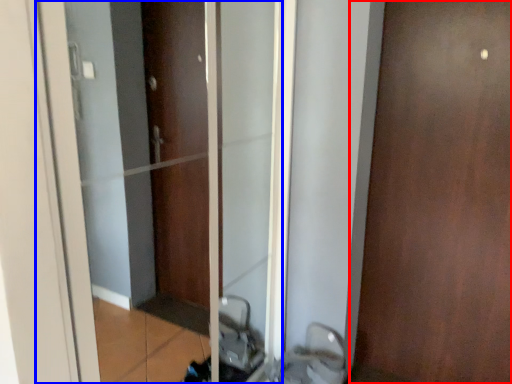
Question: Among these objects, which one is farthest to the camera, door (highlighted by a red box) or elevator (highlighted by a blue box)?

Choices:
 (A) door
 (B) elevator

Answer: (A)